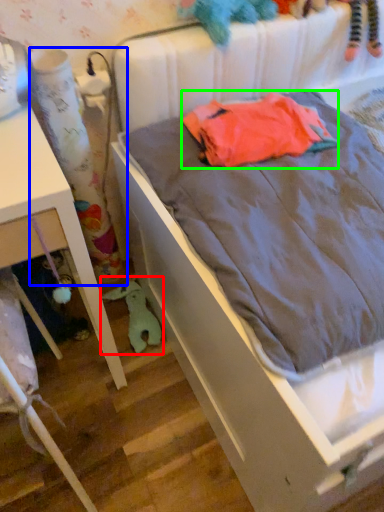
Question: Based on their relative distances, which object is farther from toy (highlighted by a red box)? Choose from curtain (highlighted by a blue box) and baby clothe (highlighted by a green box).

Choices:
 (A) curtain
 (B) baby clothe

Answer: (B)